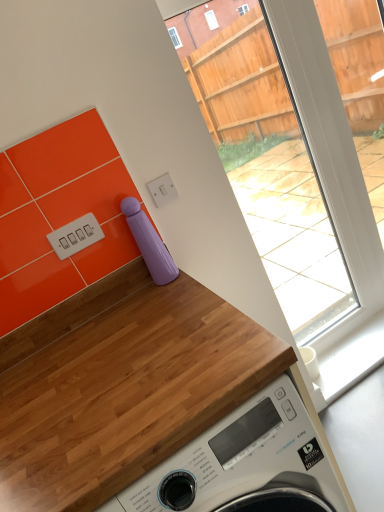
The width and height of the screenshot is (384, 512). What are the coordinates of `wooden at upper center` in the screenshot? It's located at (121, 386).

The height and width of the screenshot is (512, 384). Describe the element at coordinates (121, 386) in the screenshot. I see `wooden at upper center` at that location.

Where is `wooden at upper center`? wooden at upper center is located at coordinates (121, 386).